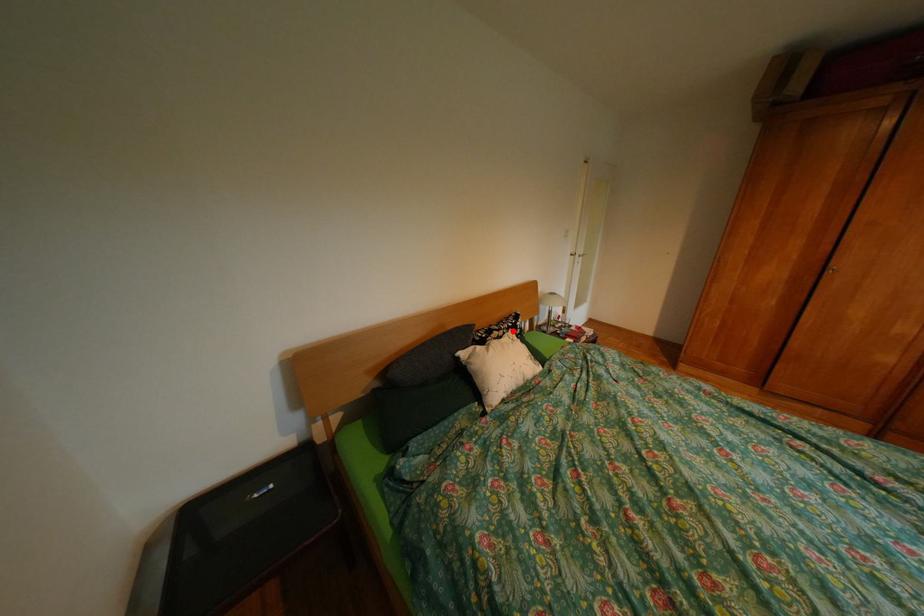
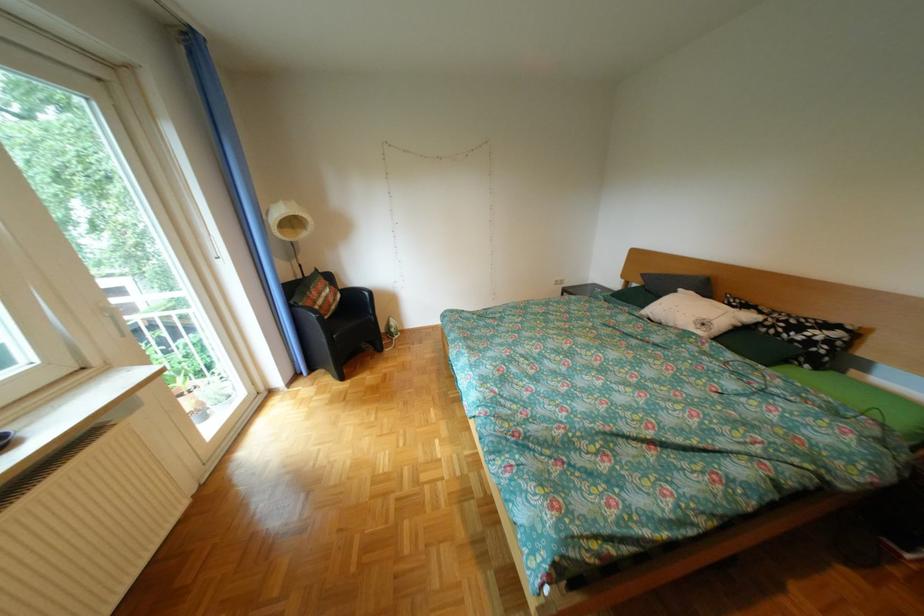
In the second image, find the point that corresponds to the highlighted location in the first image.

(775, 313)